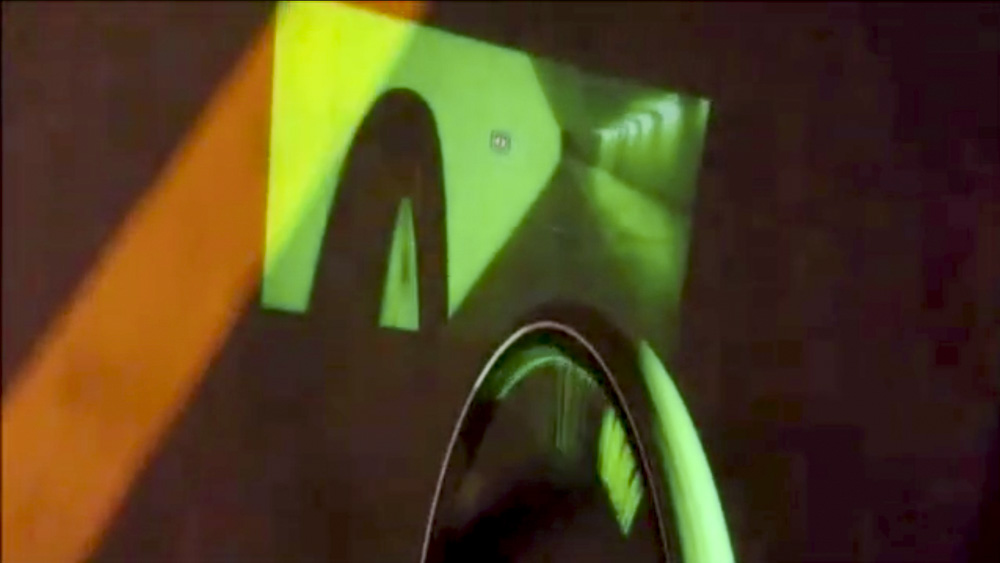
Locate an element on the screen. The image size is (1000, 563). green wall on left is located at coordinates (494, 135).